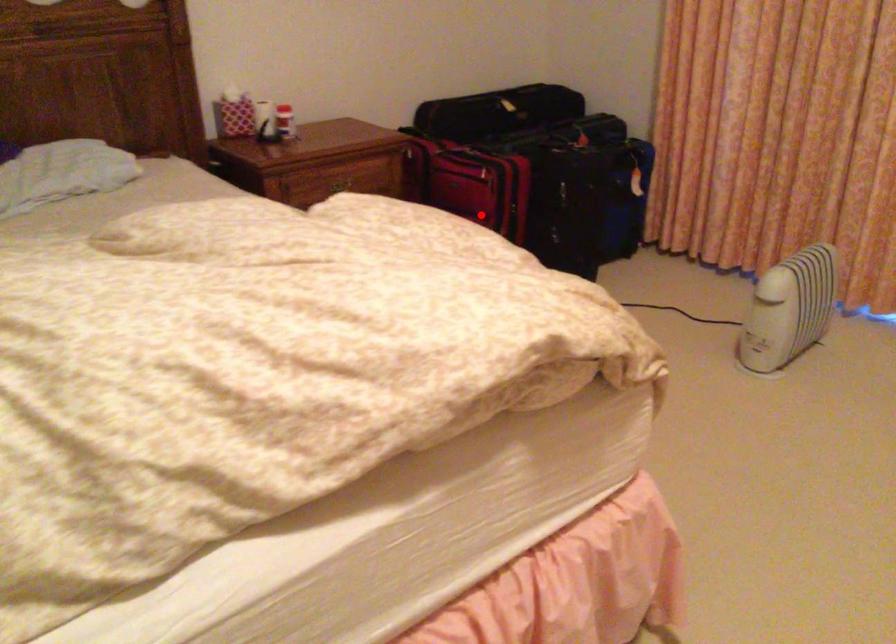
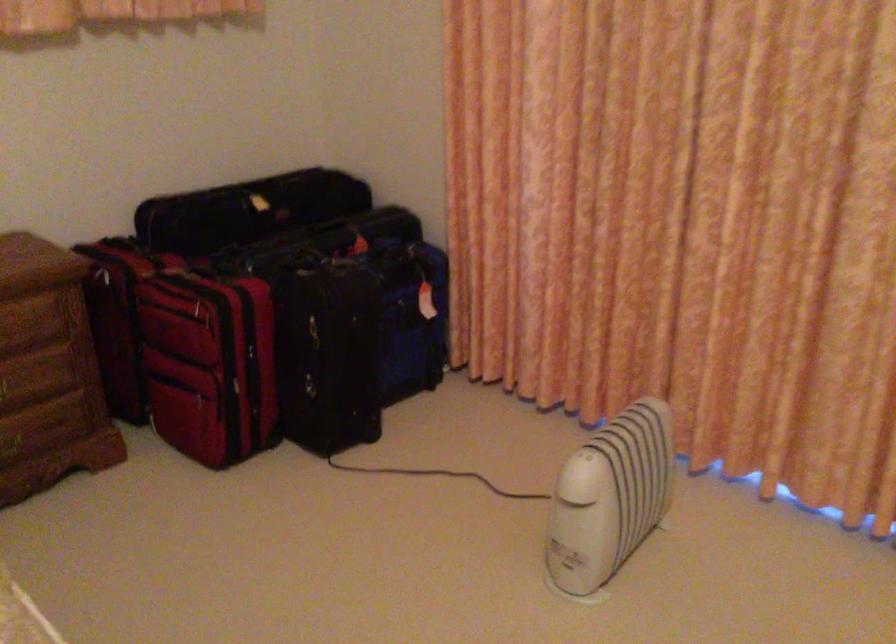
Question: I am providing you with two images of the same scene from different viewpoints. A red point is marked on the first image. Can you still see the location of the red point in image 2?

Choices:
 (A) Yes
 (B) No

Answer: (A)